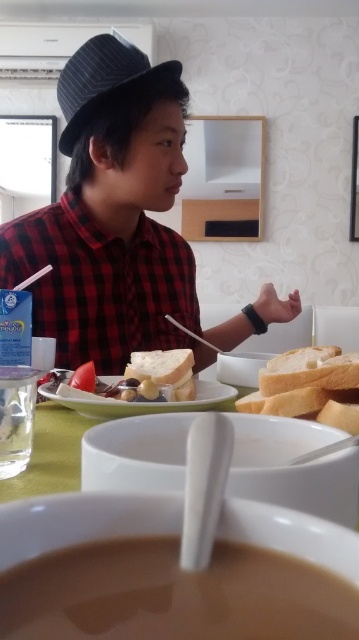
Is matte black hat at upper left wider than green matte table at center?

Correct, the width of matte black hat at upper left exceeds that of green matte table at center.

Does point (114, 97) come behind point (287, 580)?

Yes.

At what (x,y) coordinates should I click in order to perform the action: click on matte black hat at upper left. Please return your answer as a coordinate pair (x, y). Looking at the image, I should click on (112, 216).

Which is above, brown matte soup at lower center or white matte bread at center?

white matte bread at center

Does brown matte soup at lower center appear on the right side of white matte bread at center?

In fact, brown matte soup at lower center is to the left of white matte bread at center.

Is point (134, 595) positioned behind point (286, 356)?

No, (134, 595) is in front of (286, 356).

Locate an element on the screen. brown matte soup at lower center is located at coordinates (174, 595).

Is point (143, 321) positioned in front of point (309, 349)?

No, it is behind (309, 349).

Measure the distance between point [61,346] and camera.

Point [61,346] is 36.22 inches away from camera.

The image size is (359, 640). In order to click on red checkered shirt at left in this screenshot , I will do `click(100, 284)`.

At what (x,y) coordinates should I click in order to perform the action: click on red checkered shirt at left. Please return your answer as a coordinate pair (x, y). Looking at the image, I should click on (100, 284).